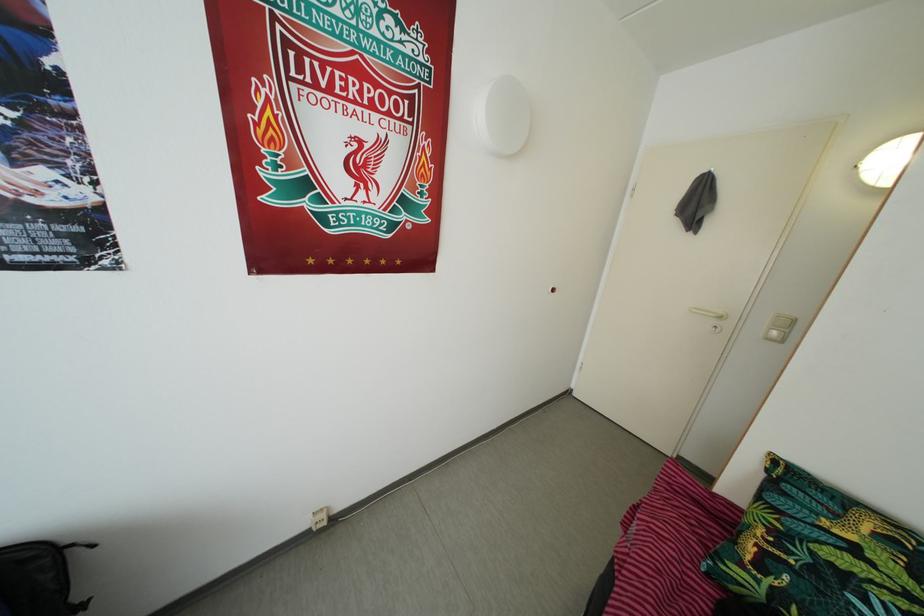
The image size is (924, 616). What are the coordinates of `door keyhole` in the screenshot? It's located at (715, 328).